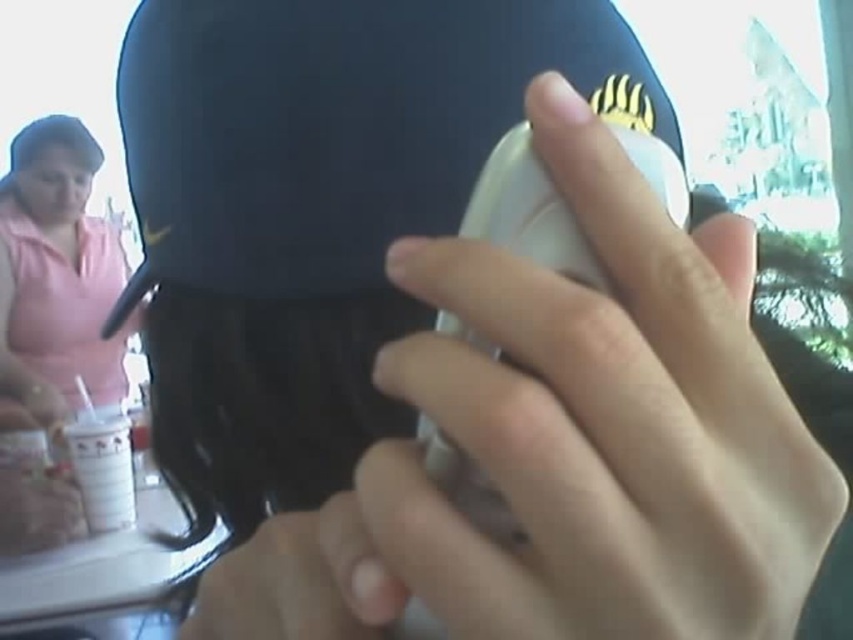
From the picture: You are at a cafe and want to place your phone on the table without covering the cup. Based on the image, can you place the white matte phone at center on top of the white paper cup at lower left?

The white matte phone at center is located above the white paper cup at lower left, so placing the phone on top of the cup would be possible as it is already positioned in that manner.

You are at a cafe and want to grab your drink from the table. You see the white paper cup at lower left and the pink cotton shirt at upper left. Which object is closer to you so you can reach it easily?

The white paper cup at lower left is behind the pink cotton shirt at upper left, so the pink cotton shirt at upper left is closer to you and easier to reach.

You are a delivery person who needs to place a white matte phone at center on a table that can only accommodate items within 6 inches from the edge. Can you safely place the phone there?

The white matte phone at center is 5.25 inches away from the viewer, so it can be placed safely on the table as it is within the 6 inches limit.